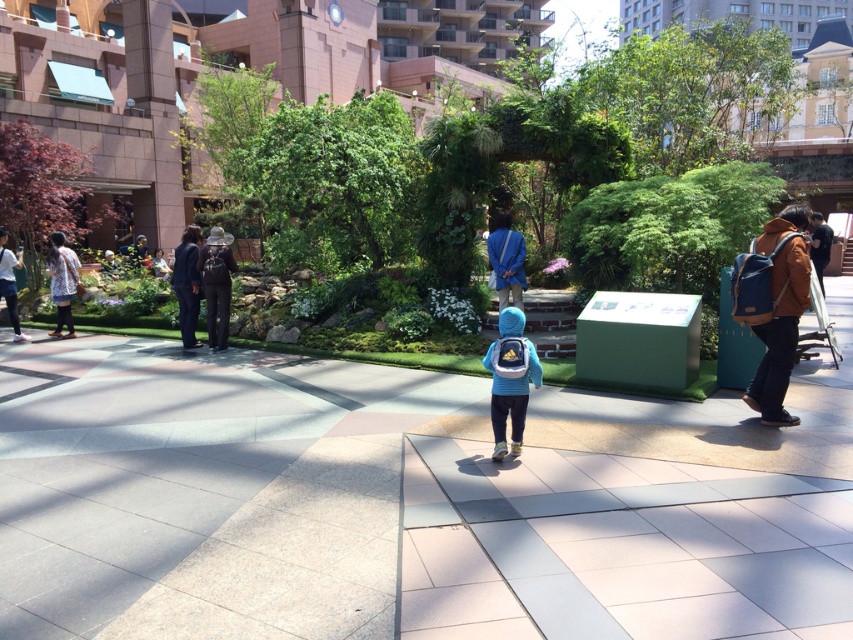
Question: Does brown canvas backpack at right have a smaller size compared to floral-patterned fabric at left?

Choices:
 (A) no
 (B) yes

Answer: (B)

Question: Which object appears closest to the camera in this image?

Choices:
 (A) smooth concrete path at center
 (B) dark blue fabric coat at left
 (C) brown canvas backpack at right

Answer: (A)

Question: Which object appears closest to the camera in this image?

Choices:
 (A) dark blue fabric coat at left
 (B) floral-patterned fabric at left
 (C) brown leather backpack at center

Answer: (C)

Question: Does matte white jacket at left have a lesser width compared to light blue fabric jacket at center?

Choices:
 (A) no
 (B) yes

Answer: (A)

Question: Does smooth concrete path at center lie in front of brown leather backpack at center?

Choices:
 (A) no
 (B) yes

Answer: (B)

Question: Which object is farther from the camera taking this photo?

Choices:
 (A) blue fabric jacket at center
 (B) brown leather backpack at center

Answer: (A)